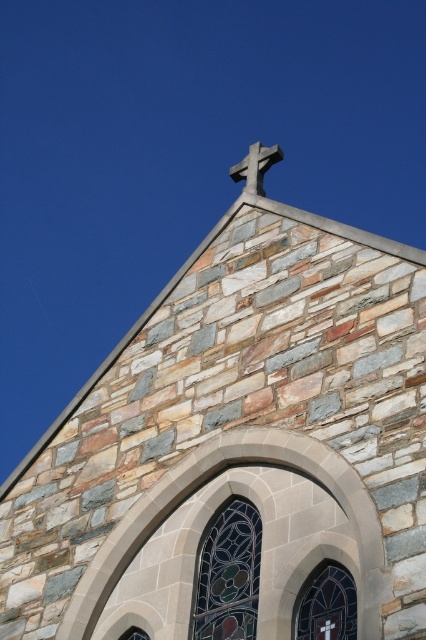
Question: Is stained glass window at upper center wider than white stone cross at upper center?

Choices:
 (A) no
 (B) yes

Answer: (A)

Question: From the image, what is the correct spatial relationship of stained glass window at center in relation to stained glass window at upper center?

Choices:
 (A) right
 (B) left

Answer: (B)

Question: Which is farther from the white stone cross at upper center?

Choices:
 (A) stained glass window at center
 (B) stained glass window at upper center

Answer: (B)

Question: From the image, what is the correct spatial relationship of stained glass window at center in relation to stained glass window at upper center?

Choices:
 (A) above
 (B) below

Answer: (A)

Question: Which point is closer to the camera?

Choices:
 (A) stained glass window at center
 (B) stained glass window at upper center
 (C) white stone cross at upper center

Answer: (B)

Question: Which object appears closest to the camera in this image?

Choices:
 (A) stained glass window at center
 (B) white stone cross at upper center

Answer: (A)